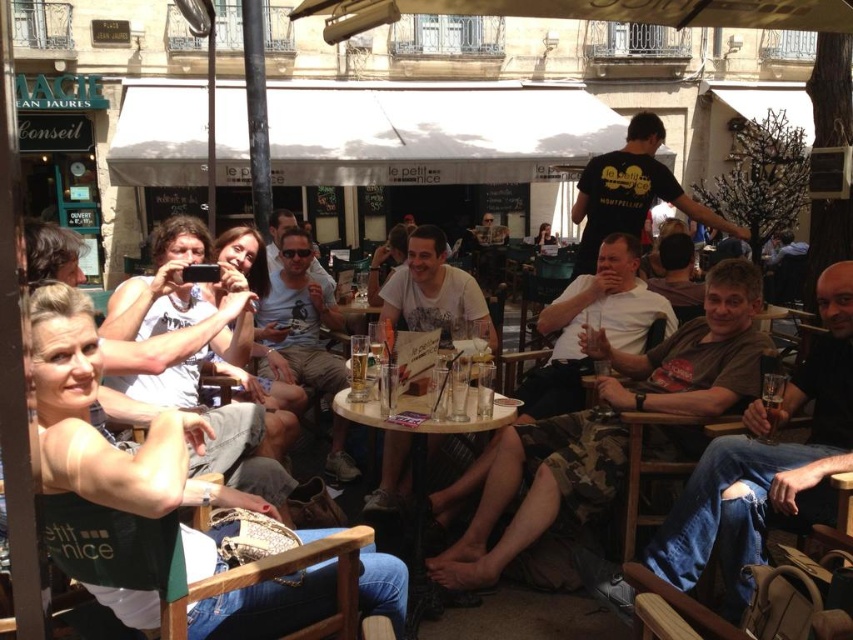
Question: Estimate the real-world distances between objects in this image. Which object is closer to the translucent glass table at center?

Choices:
 (A) matte black tank top at left
 (B) camouflage pants at center
 (C) black t-shirt at upper center

Answer: (B)

Question: Can you confirm if matte black tank top at left is positioned above translucent glass table at center?

Choices:
 (A) yes
 (B) no

Answer: (B)

Question: Among these objects, which one is nearest to the camera?

Choices:
 (A) translucent glass beverage at lower right
 (B) translucent glass table at center

Answer: (A)

Question: Considering the real-world distances, which object is farthest from the matte black tank top at left?

Choices:
 (A) translucent glass beverage at lower right
 (B) translucent glass table at center
 (C) camouflage pants at center
 (D) black t-shirt at upper center

Answer: (D)

Question: Observing the image, what is the correct spatial positioning of black t-shirt at upper center in reference to translucent glass beverage at lower right?

Choices:
 (A) above
 (B) below

Answer: (A)

Question: Does camouflage pants at center appear under black t-shirt at upper center?

Choices:
 (A) yes
 (B) no

Answer: (A)